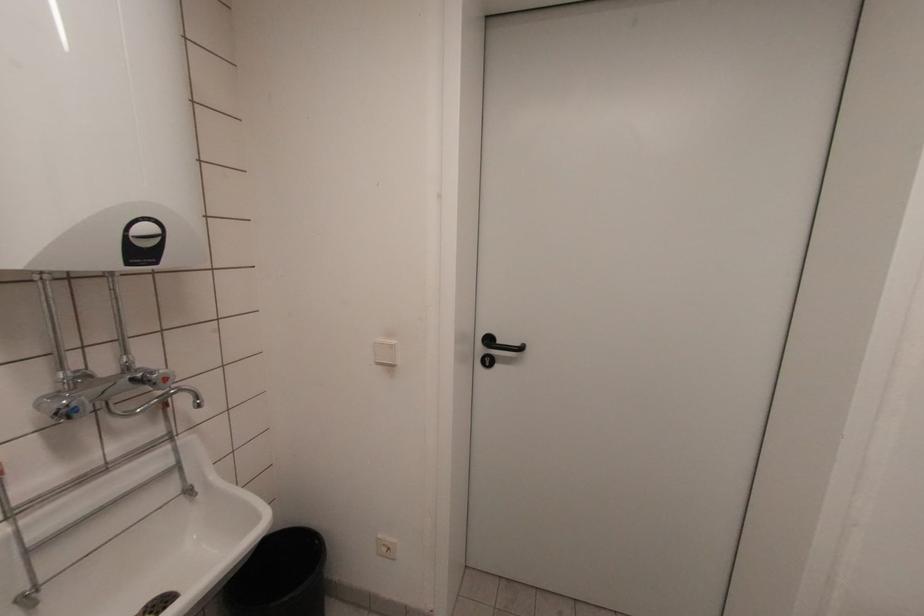
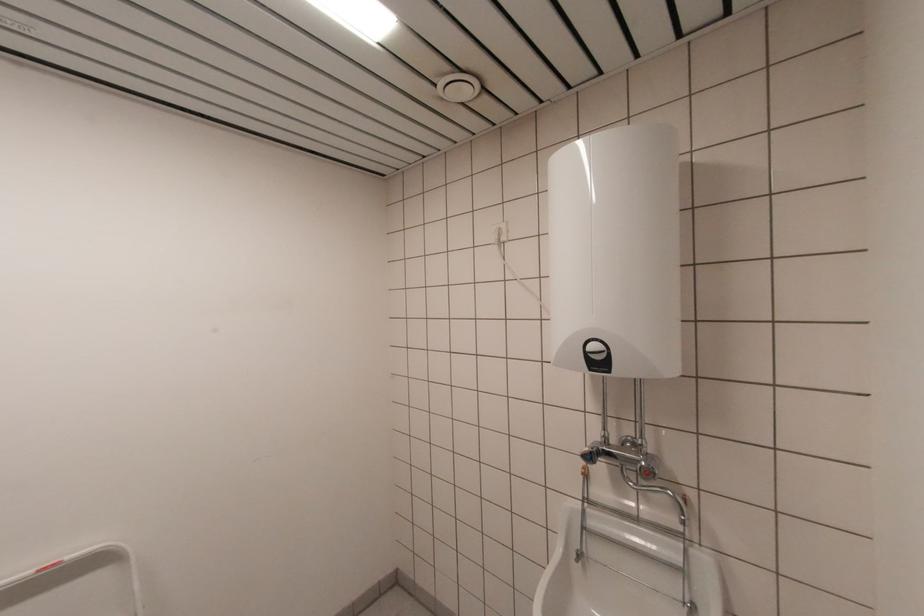
Locate, in the second image, the point that corresponds to the point at 160,238 in the first image.

(605, 354)